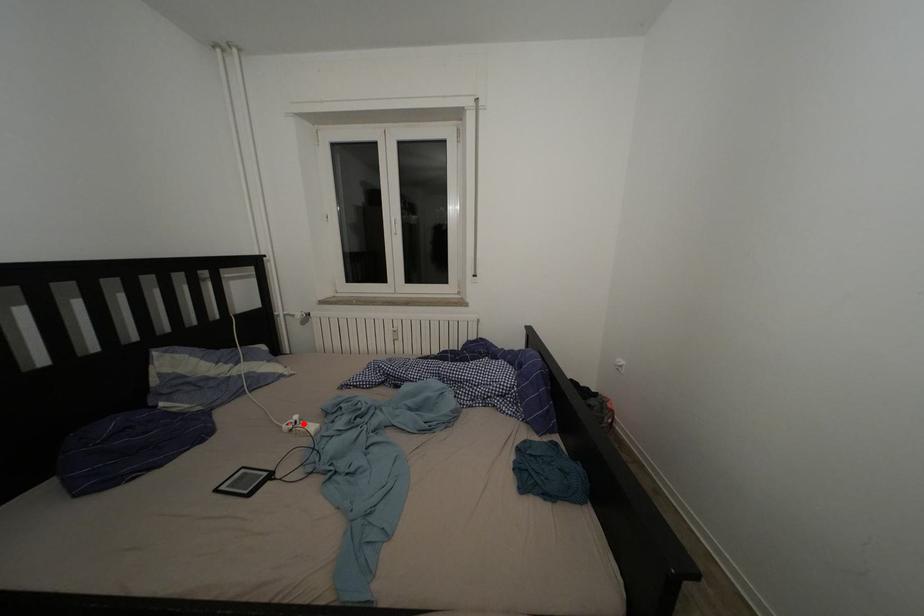
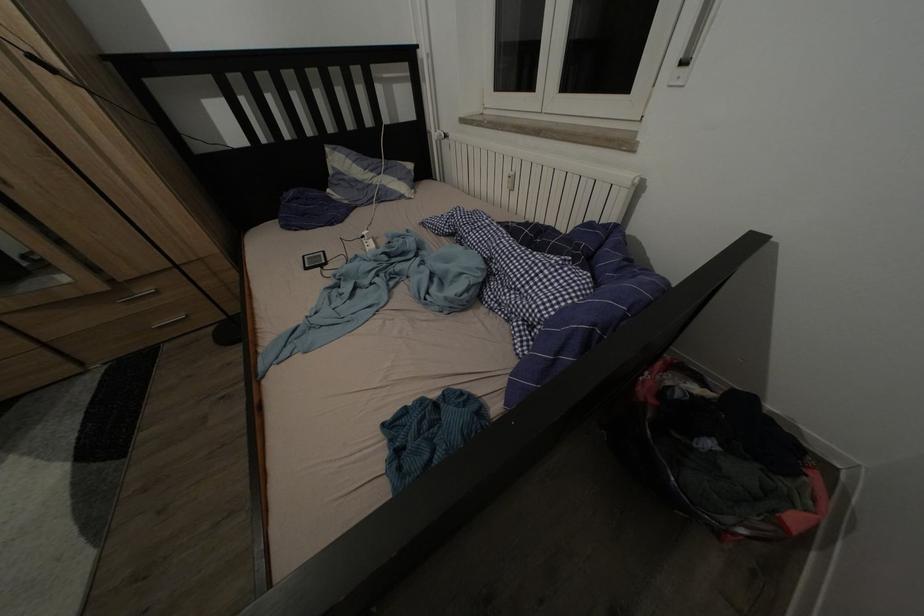
Question: I am providing you with two images of the same scene from different viewpoints. In image1, a red point is highlighted. Considering the same 3D point in image2, which of the following is correct?

Choices:
 (A) It is closer
 (B) It is farther

Answer: (B)